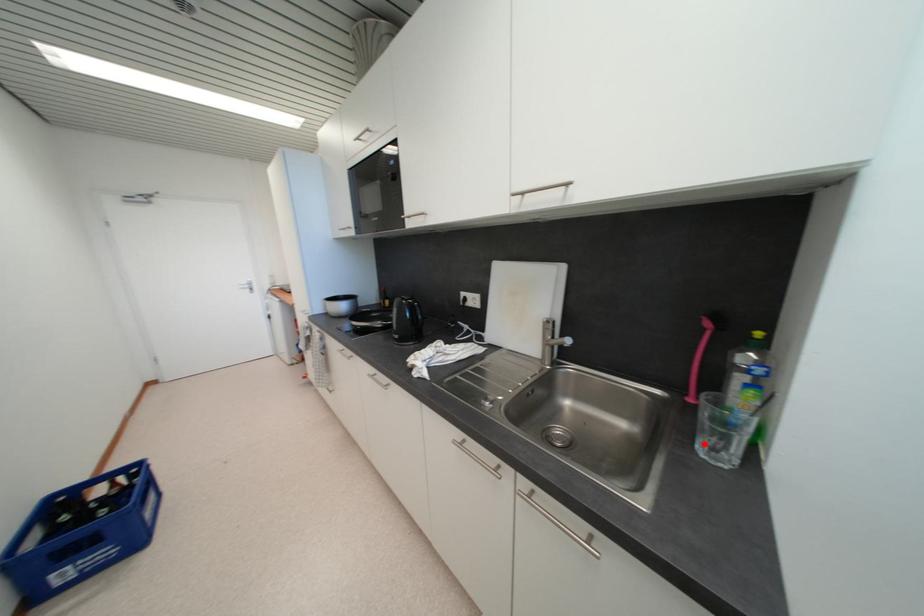
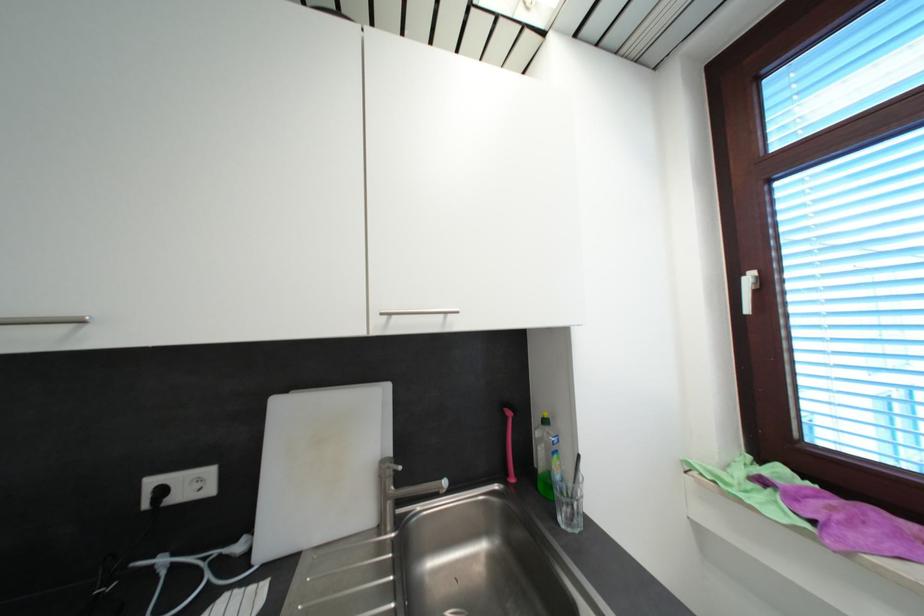
Where in the second image is the point corresponding to the highlighted location from the first image?

(565, 522)